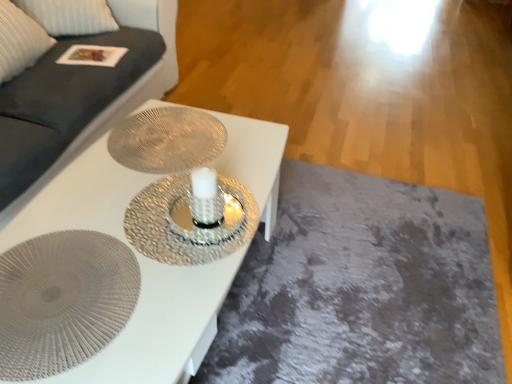
Identify the location of vacant space behind textured silver plate at center, which is counted as the second oval, starting from the back. This screenshot has width=512, height=384. (87, 195).